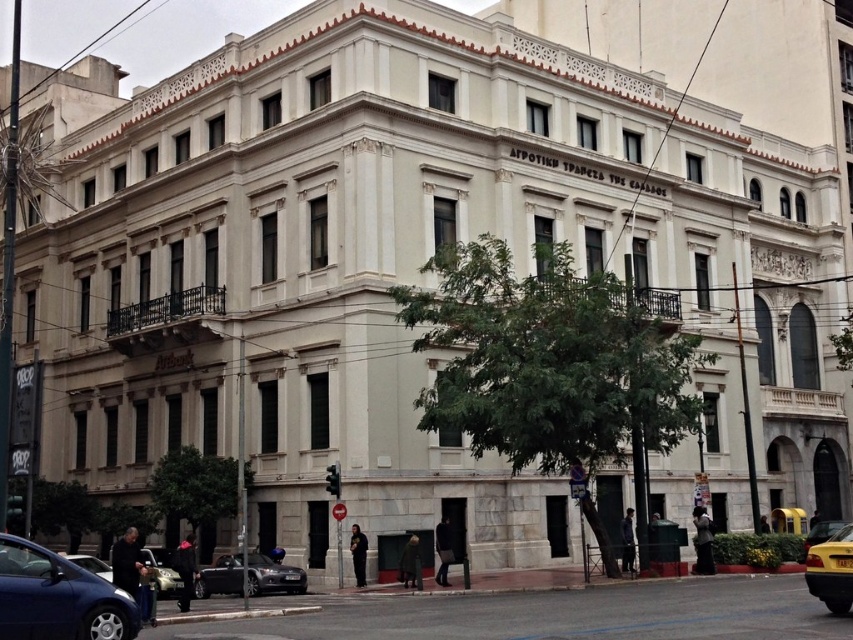
Does matte silver car at lower left lie behind yellow metallic taxi at lower right?

No, it is not.

Can you confirm if matte silver car at lower left is taller than yellow metallic taxi at lower right?

Correct, matte silver car at lower left is much taller as yellow metallic taxi at lower right.

Which is in front, point (149, 557) or point (787, 516)?

Point (149, 557)

Where is `matte silver car at lower left`? The image size is (853, 640). matte silver car at lower left is located at coordinates (161, 568).

Does shiny black car at lower left have a greater width compared to matte silver car at lower left?

No, shiny black car at lower left is not wider than matte silver car at lower left.

The height and width of the screenshot is (640, 853). I want to click on shiny black car at lower left, so click(273, 577).

You are a GUI agent. You are given a task and a screenshot of the screen. Output one action in this format:
    pyautogui.click(x=<x>, y=<y>)
    Task: Click on the shiny black car at lower left
    The image size is (853, 640).
    Given the screenshot: What is the action you would take?
    pyautogui.click(x=273, y=577)

The width and height of the screenshot is (853, 640). In order to click on shiny black car at lower left in this screenshot , I will do `click(273, 577)`.

Where is `shiny black car at lower left`? shiny black car at lower left is located at coordinates (273, 577).

Is shiny black car at lower left to the right of yellow rubber taxi at lower right from the viewer's perspective?

Incorrect, shiny black car at lower left is not on the right side of yellow rubber taxi at lower right.

Is point (265, 580) positioned after point (820, 589)?

Yes, it is behind point (820, 589).

This screenshot has height=640, width=853. I want to click on shiny black car at lower left, so click(x=273, y=577).